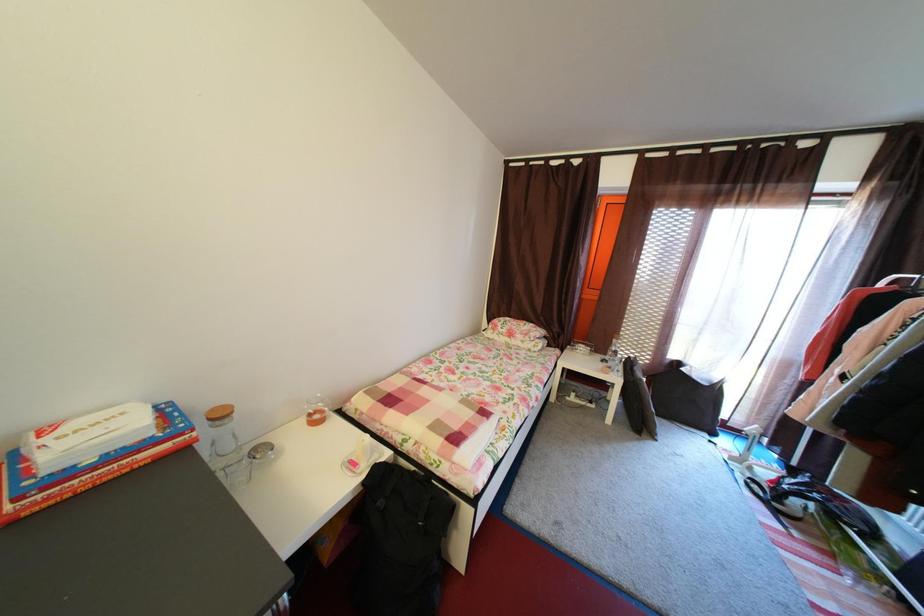
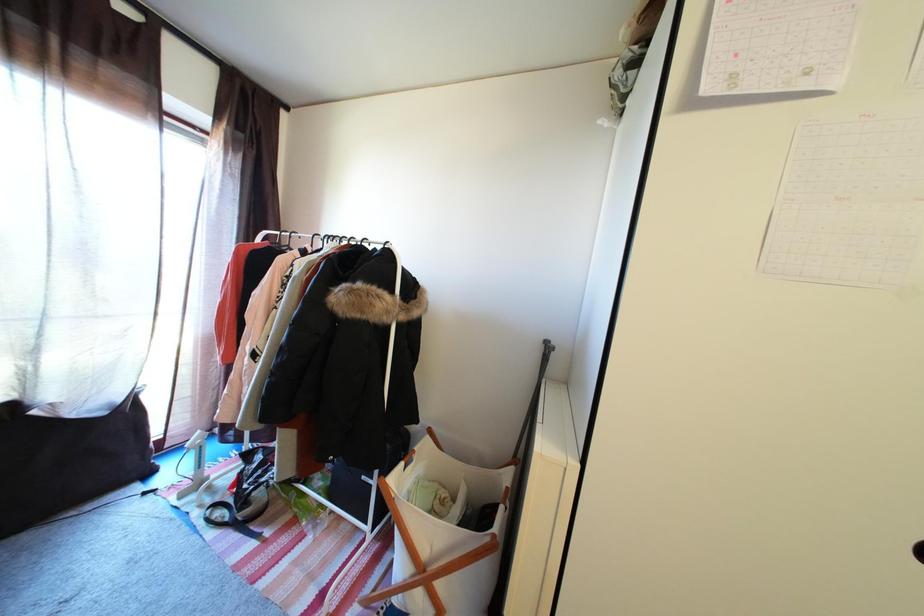
Question: How did the camera likely rotate?

Choices:
 (A) Left
 (B) Right
 (C) Up
 (D) Down

Answer: (B)